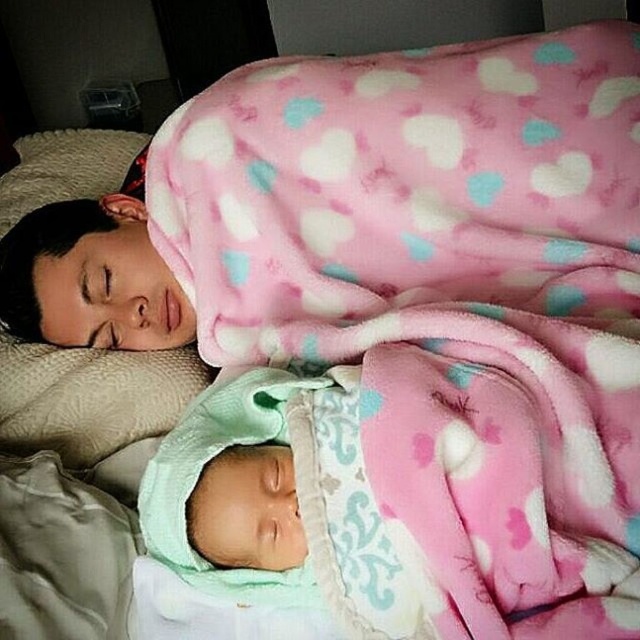
You are a caregiver who needs to check on the baby. The green fleece baby at lower center is currently lying next to the beige quilted pillow at upper left. How far apart are these two items?

The green fleece baby at lower center and the beige quilted pillow at upper left are 15.26 inches apart.

In the scene shown: You are a photographer trying to capture a closeup shot of the green fleece baby at lower center and the beige quilted pillow at upper left. Since you want to focus on the baby, which object should you adjust your camera lens to prioritize in terms of size in the frame?

The green fleece baby at lower center has a lesser height compared to the beige quilted pillow at upper left, so to prioritize the baby in terms of size, you should adjust the camera lens to focus on the green fleece baby at lower center while considering its smaller stature.